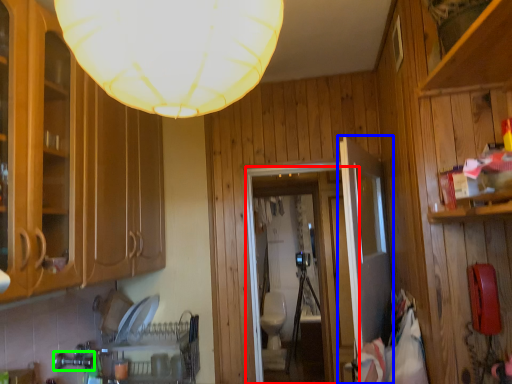
Question: Based on their relative distances, which object is farther from glass door (highlighted by a red box)? Choose from door (highlighted by a blue box) and faucet (highlighted by a green box).

Choices:
 (A) door
 (B) faucet

Answer: (B)